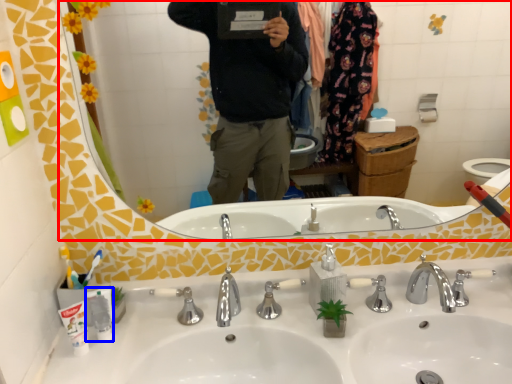
Question: Which object appears farthest to the camera in this image, mirror (highlighted by a red box) or toiletry (highlighted by a blue box)?

Choices:
 (A) mirror
 (B) toiletry

Answer: (B)